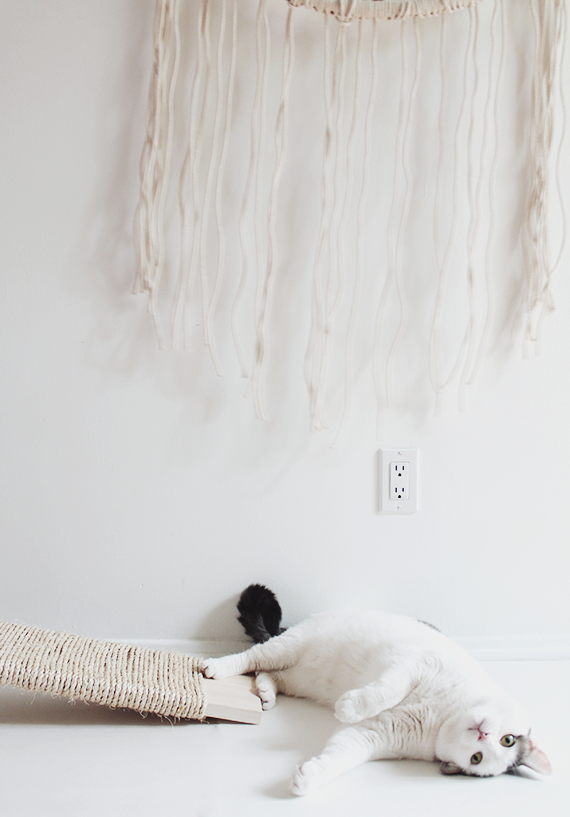
Find the location of `white floor`. white floor is located at coordinates (268, 773).